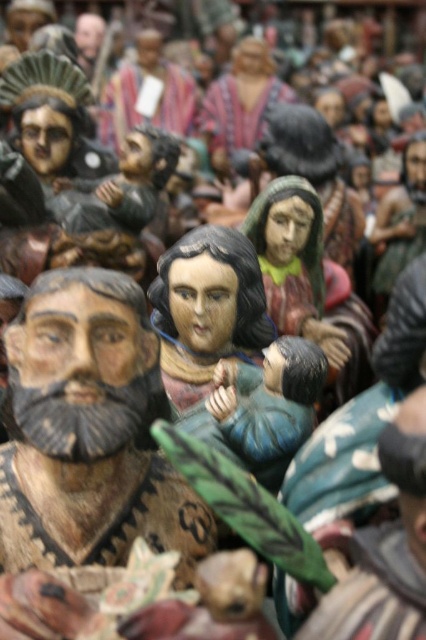
Question: Among these points, which one is nearest to the camera?

Choices:
 (A) (206, 513)
 (B) (267, 321)

Answer: (A)

Question: Is wooden statue at center in front of wooden figure at center?

Choices:
 (A) no
 (B) yes

Answer: (A)

Question: Does wooden statue at center appear on the right side of wooden figure at center?

Choices:
 (A) yes
 (B) no

Answer: (A)

Question: Among these objects, which one is nearest to the camera?

Choices:
 (A) wooden statue at center
 (B) wooden figure at center

Answer: (B)

Question: Can you confirm if wooden statue at center is positioned above wooden figure at center?

Choices:
 (A) no
 (B) yes

Answer: (B)